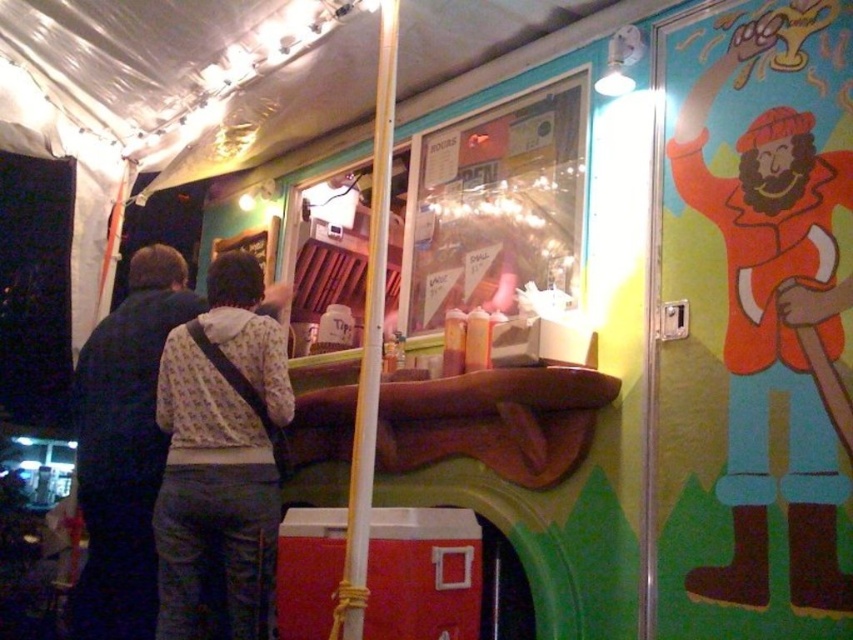
Who is lower down, white printed shirt at center or wooden pole at center?

white printed shirt at center

In the scene shown: Can you confirm if white printed shirt at center is wider than wooden pole at center?

Indeed, white printed shirt at center has a greater width compared to wooden pole at center.

Does point (254, 289) lie in front of point (352, 518)?

No, it is behind (352, 518).

Image resolution: width=853 pixels, height=640 pixels. I want to click on white printed shirt at center, so click(x=212, y=497).

Is white printed shirt at center below dark blue jacket at left?

No.

Between white printed shirt at center and dark blue jacket at left, which one appears on the right side from the viewer's perspective?

white printed shirt at center is more to the right.

Between point (206, 387) and point (74, 396), which one is positioned behind?

Point (74, 396)

You are a GUI agent. You are given a task and a screenshot of the screen. Output one action in this format:
    pyautogui.click(x=<x>, y=<y>)
    Task: Click on the white printed shirt at center
    The image size is (853, 640).
    Given the screenshot: What is the action you would take?
    pyautogui.click(x=212, y=497)

Is point (175, 259) less distant than point (350, 492)?

No, it is behind (350, 492).

Is dark blue jacket at left further to camera compared to wooden pole at center?

Yes, dark blue jacket at left is behind wooden pole at center.

Which is behind, point (141, 540) or point (352, 624)?

The point (141, 540) is more distant.

Locate an element on the screen. dark blue jacket at left is located at coordinates (125, 448).